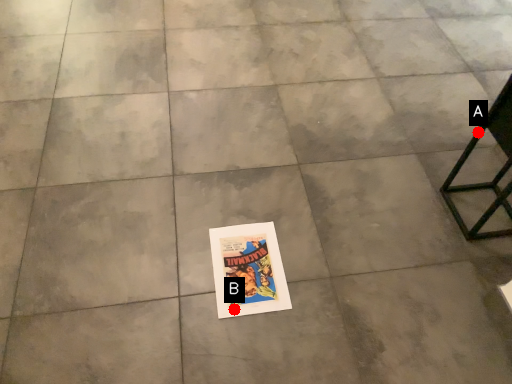
Question: Two points are circled on the image, labeled by A and B beside each circle. Which point is farther from the camera taking this photo?

Choices:
 (A) A is further
 (B) B is further

Answer: (A)